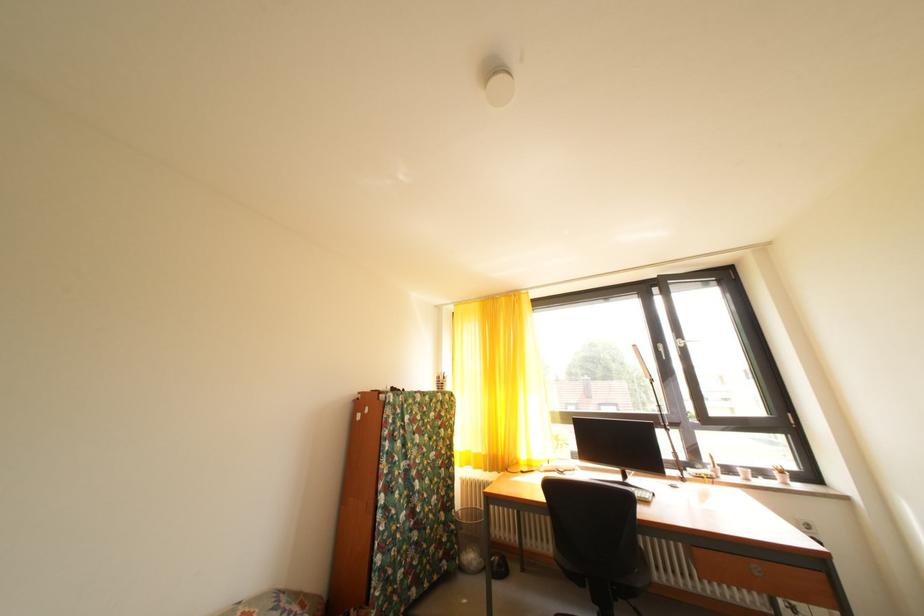
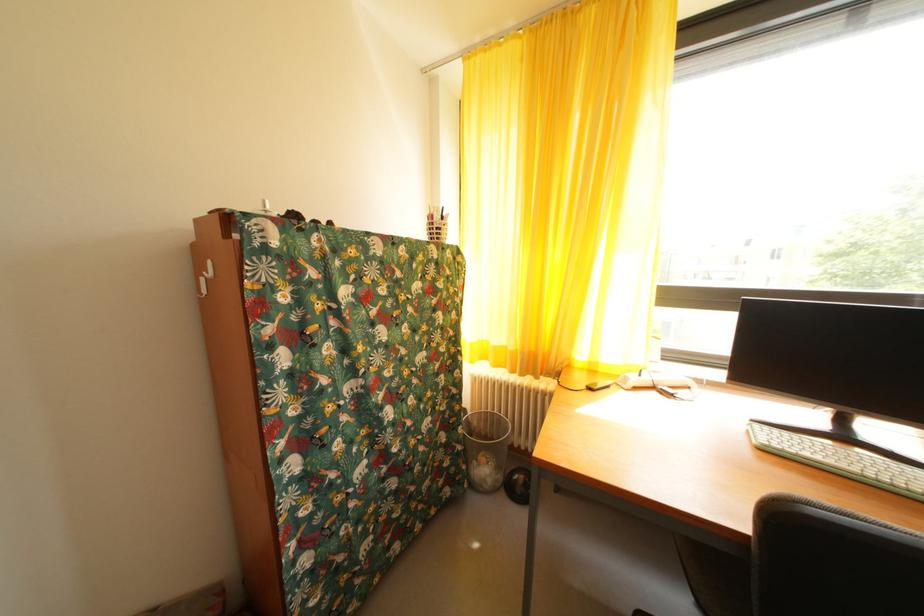
Find the pixel in the second image that matches pixel 462 533 in the first image.

(468, 454)